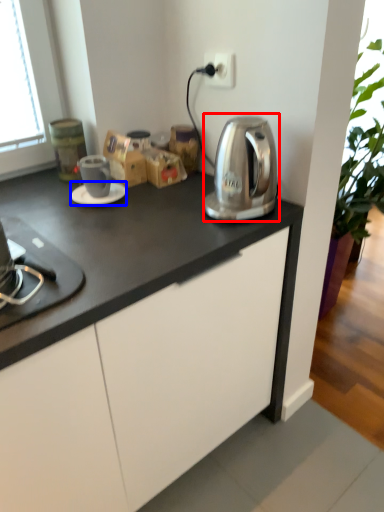
Question: Among these objects, which one is farthest to the camera, kitchen appliance (highlighted by a red box) or saucer (highlighted by a blue box)?

Choices:
 (A) kitchen appliance
 (B) saucer

Answer: (B)